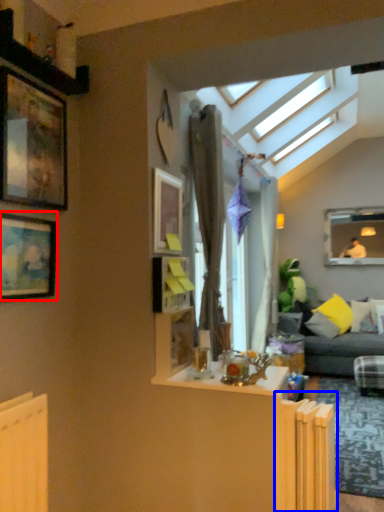
Question: Which object is closer to the camera taking this photo, picture frame (highlighted by a red box) or radiator (highlighted by a blue box)?

Choices:
 (A) picture frame
 (B) radiator

Answer: (A)